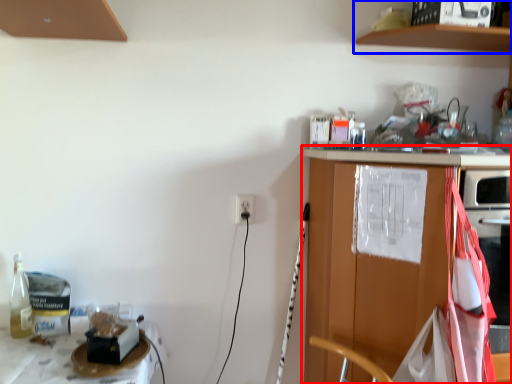
Question: Which of the following is the closest to the observer, countertop (highlighted by a red box) or shelf (highlighted by a blue box)?

Choices:
 (A) countertop
 (B) shelf

Answer: (A)